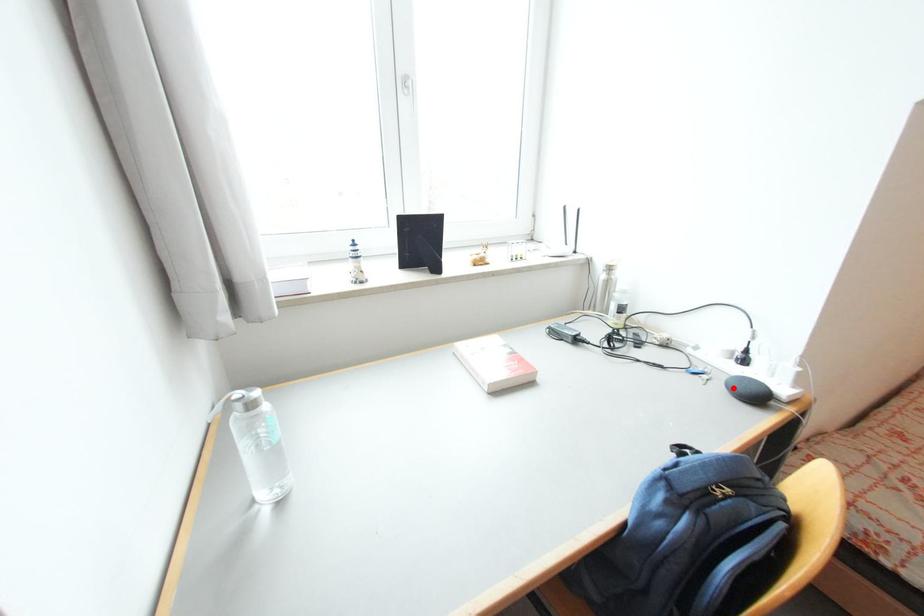
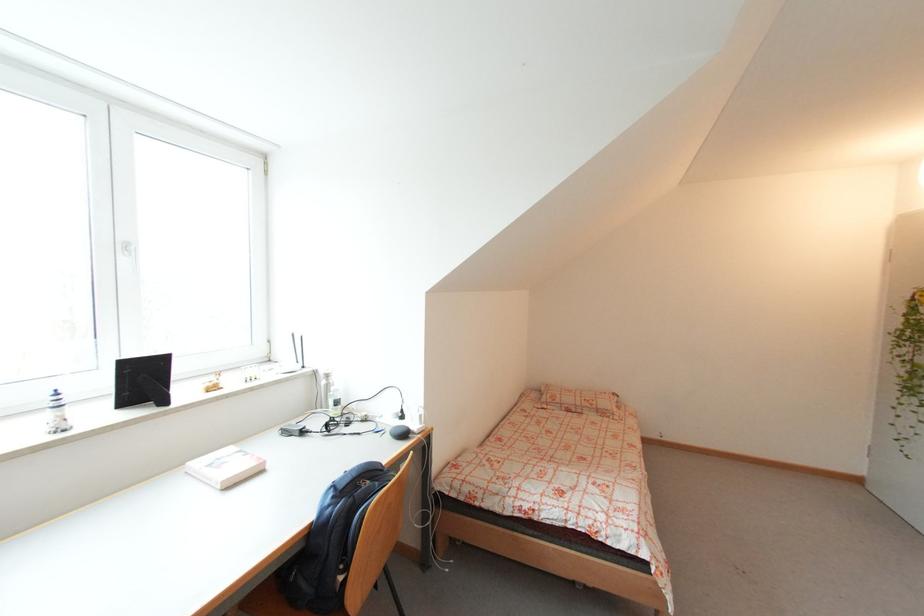
Where in the second image is the point corresponding to the highlighted location from the first image?

(395, 435)